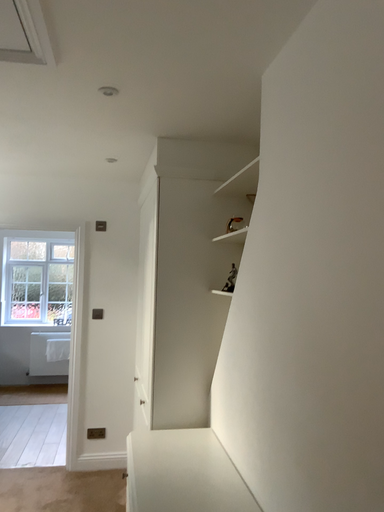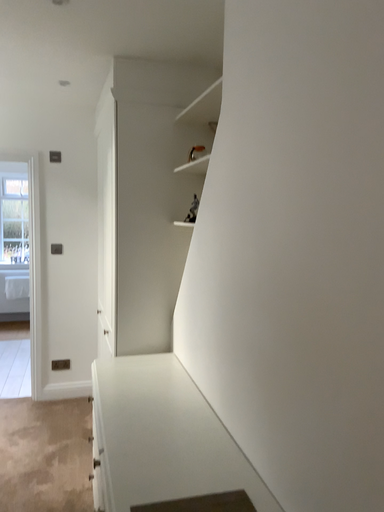
Question: How did the camera likely rotate when shooting the video?

Choices:
 (A) rotated upward
 (B) rotated downward

Answer: (B)